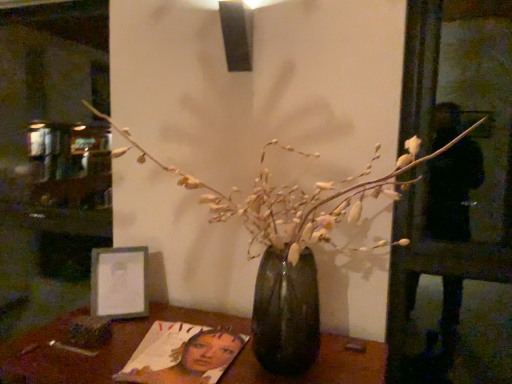
I want to click on free location to the right of matte paper magazine at lower center, so click(x=283, y=364).